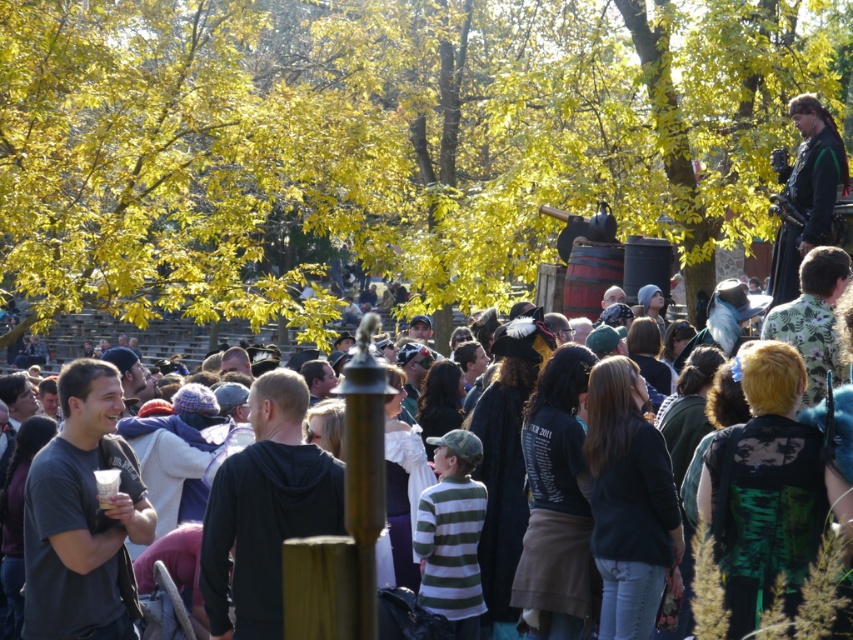
Question: Among these objects, which one is farthest from the camera?

Choices:
 (A) dark brown leather jacket at center
 (B) dark green leather jacket at upper right

Answer: (B)

Question: Can you confirm if yellow leafy tree at upper center is thinner than dark brown leather jacket at center?

Choices:
 (A) yes
 (B) no

Answer: (B)

Question: Which object appears farthest from the camera in this image?

Choices:
 (A) dark brown leather jacket at center
 (B) dark green leather jacket at upper right
 (C) yellow leafy tree at upper center
 (D) black matte t-shirt at left

Answer: (C)

Question: Which object appears closest to the camera in this image?

Choices:
 (A) dark brown leather jacket at center
 (B) dark green leather jacket at upper right
 (C) black matte t-shirt at left

Answer: (A)

Question: From the image, what is the correct spatial relationship of yellow leafy tree at upper center in relation to dark brown leather jacket at center?

Choices:
 (A) below
 (B) above

Answer: (B)

Question: Can you confirm if yellow leafy tree at upper center is positioned below dark brown leather jacket at center?

Choices:
 (A) no
 (B) yes

Answer: (A)